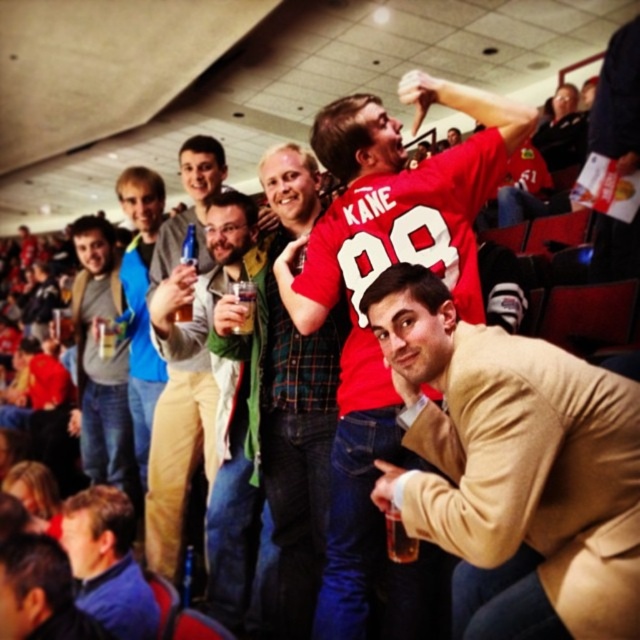
You are an event organizer trying to place a banner in front of the tan sweater at center. What coordinates should you use to ensure the banner is directly in front of it?

The banner should be placed at coordinates approximately (513,468) to be directly in front of the tan sweater at center.

Based on the photo, you are a photographer at the sports event and want to take a photo that includes both the point at coordinates point (x=449, y=541) and point (x=163, y=456). Which point should you focus on to ensure both are in focus?

You should focus on point (x=449, y=541) because it is closer to the camera, and focusing on the closer object will keep both in focus.

You are a photographer trying to capture a candid shot of the tan sweater at center and the green fabric jacket at center. Which of these two items will appear larger in your photo?

The tan sweater at center will appear larger in the photo because it is closer to the viewer than the green fabric jacket at center.